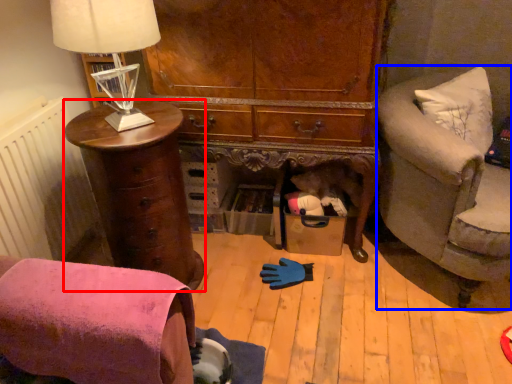
Question: Among these objects, which one is farthest to the camera, chest of drawers (highlighted by a red box) or studio couch (highlighted by a blue box)?

Choices:
 (A) chest of drawers
 (B) studio couch

Answer: (A)